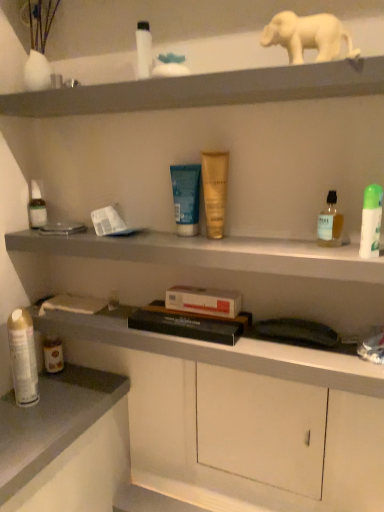
Find the location of a particular element. This screenshot has width=384, height=512. space that is in front of translucent plastic bottle at left, arranged as the first toiletry when viewed from the back is located at coordinates (42, 232).